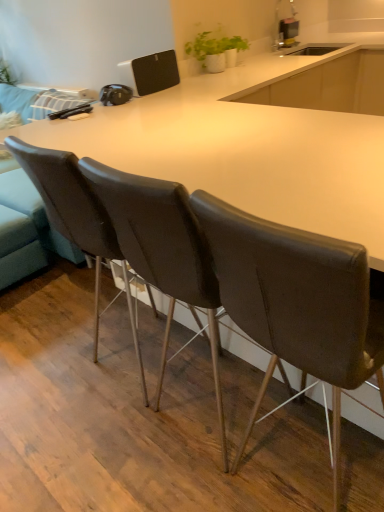
In order to click on vacant area that lies between brown leather chair at center, arranged as the 3th chair when viewed from the left, and leather at center, the 2th chair positioned from the right in this screenshot , I will do `click(265, 438)`.